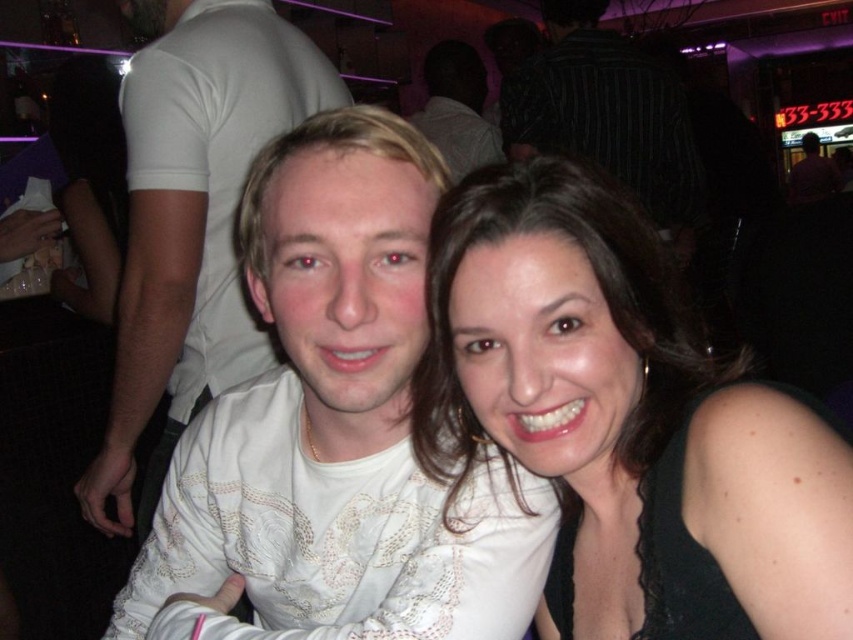
Question: Which object is positioned farthest from the white lace shirt at center?

Choices:
 (A) white textured shirt at center
 (B) white lace shirt at left
 (C) smooth brown hair at center

Answer: (C)

Question: Does white lace shirt at left appear on the left side of white lace shirt at center?

Choices:
 (A) yes
 (B) no

Answer: (A)

Question: Among these objects, which one is farthest from the camera?

Choices:
 (A) smooth brown hair at center
 (B) white lace shirt at center
 (C) striped shirt at upper center
 (D) white textured shirt at center

Answer: (B)

Question: Does white textured shirt at center have a greater width compared to striped shirt at upper center?

Choices:
 (A) yes
 (B) no

Answer: (B)

Question: Estimate the real-world distances between objects in this image. Which object is farther from the white lace shirt at left?

Choices:
 (A) smooth brown hair at center
 (B) striped shirt at upper center
 (C) white textured shirt at center
 (D) white lace shirt at center

Answer: (D)

Question: Considering the relative positions of white textured shirt at center and striped shirt at upper center in the image provided, where is white textured shirt at center located with respect to striped shirt at upper center?

Choices:
 (A) below
 (B) above

Answer: (A)